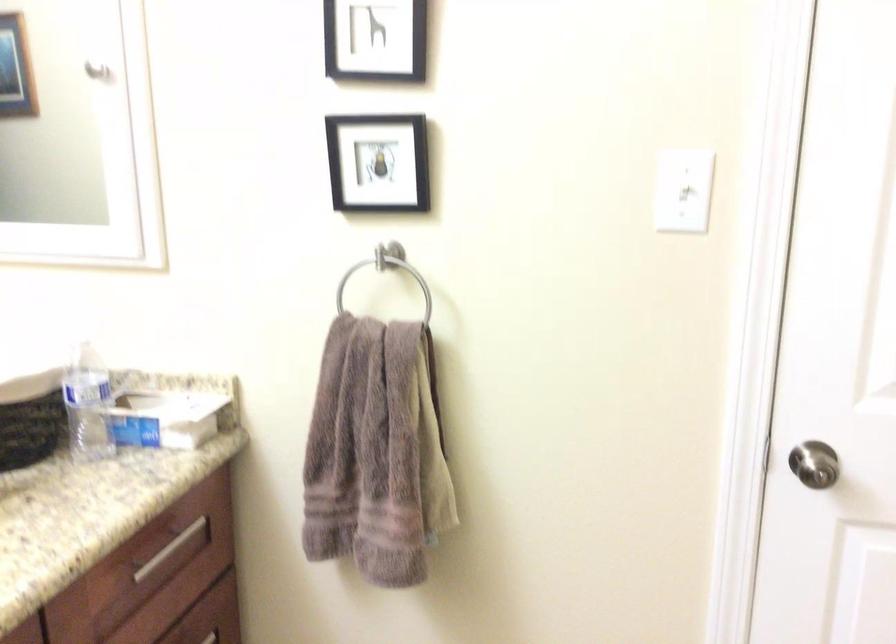
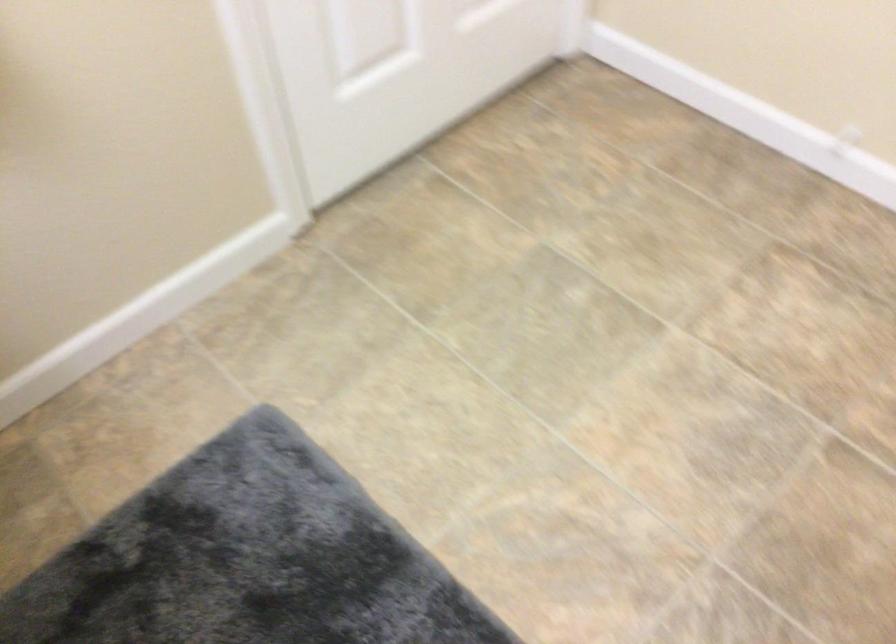
The first image is from the beginning of the video and the second image is from the end. How did the camera likely rotate when shooting the video?

The camera's rotation is toward right-down.